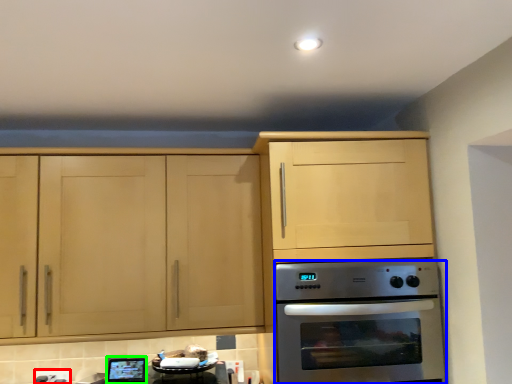
Question: Estimate the real-world distances between objects in this image. Which object is farther from electric outlet (highlighted by a red box), oven (highlighted by a blue box) or appliance (highlighted by a green box)?

Choices:
 (A) oven
 (B) appliance

Answer: (A)